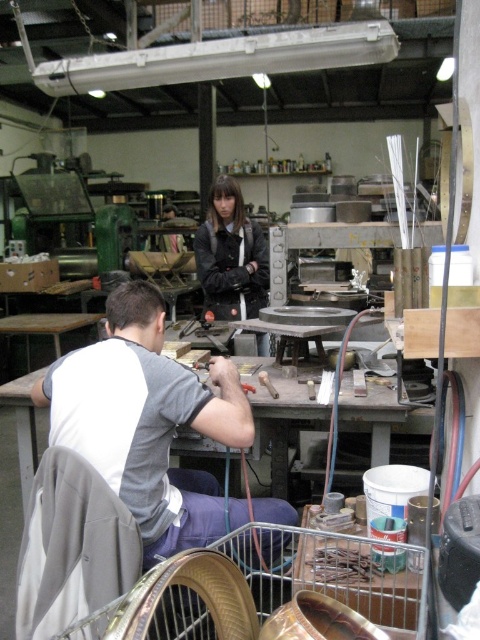
Does gray cotton shirt at center lie in front of matte black jacket at center?

Yes, gray cotton shirt at center is in front of matte black jacket at center.

The height and width of the screenshot is (640, 480). I want to click on gray cotton shirt at center, so click(x=145, y=420).

Can you confirm if metallic gray table at center is shorter than metallic red-handled screwdriver at center?

Incorrect, metallic gray table at center's height does not fall short of metallic red-handled screwdriver at center's.

Can you confirm if metallic gray table at center is smaller than metallic red-handled screwdriver at center?

No, metallic gray table at center is not smaller than metallic red-handled screwdriver at center.

The image size is (480, 640). In order to click on metallic gray table at center in this screenshot , I will do `click(290, 337)`.

Is matte black jacket at center behind metallic red-handled screwdriver at center?

Yes, it is.

In the scene shown: Is matte black jacket at center closer to the viewer compared to metallic red-handled screwdriver at center?

No, matte black jacket at center is further to the viewer.

The image size is (480, 640). Identify the location of matte black jacket at center. (230, 256).

Where is `matte black jacket at center`? matte black jacket at center is located at coordinates (230, 256).